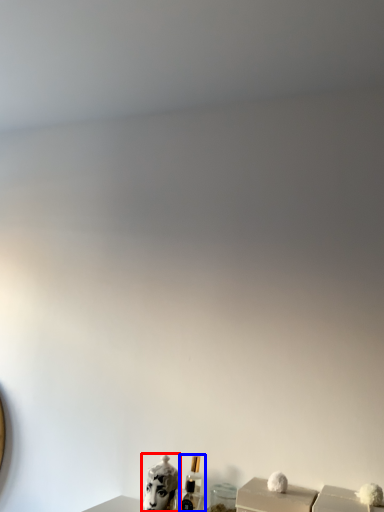
Question: Which object appears closest to the camera in this image, animal (highlighted by a red box) or perfume (highlighted by a blue box)?

Choices:
 (A) animal
 (B) perfume

Answer: (A)